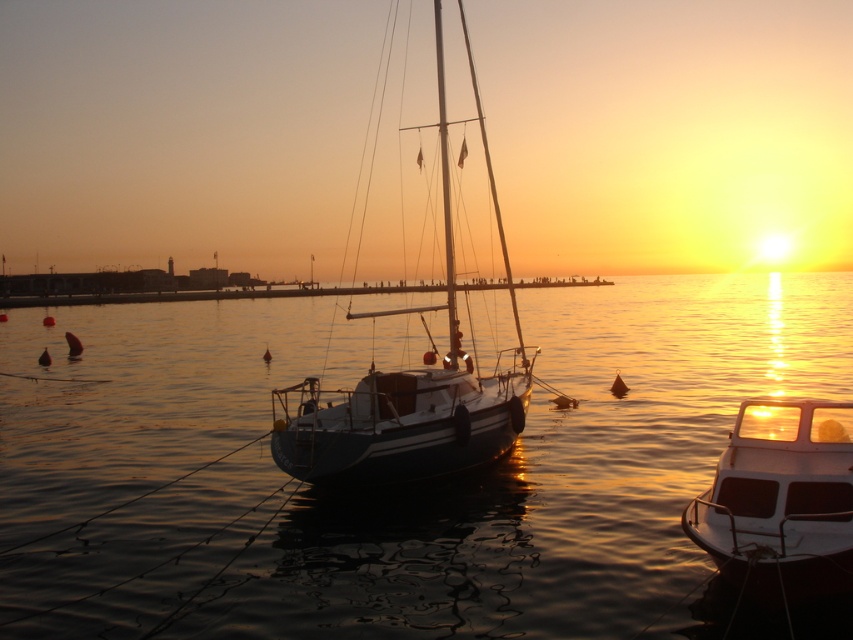
Who is taller, glossy water at center or white glossy sailboat at center?

white glossy sailboat at center

Between point (819, 273) and point (306, 420), which one is positioned behind?

The point (819, 273) is behind.

This screenshot has width=853, height=640. In order to click on glossy water at center in this screenshot , I will do `click(554, 476)`.

Can you confirm if white glossy sailboat at center is thinner than white glossy boat at lower right?

Incorrect, white glossy sailboat at center's width is not less than white glossy boat at lower right's.

From the picture: Can you confirm if white glossy sailboat at center is positioned to the left of white glossy boat at lower right?

Yes, white glossy sailboat at center is to the left of white glossy boat at lower right.

In order to click on white glossy sailboat at center in this screenshot , I will do `click(412, 380)`.

Is point (424, 545) positioned in front of point (846, 561)?

No, (424, 545) is further to viewer.

Can you confirm if glossy water at center is positioned to the left of white glossy boat at lower right?

Yes, glossy water at center is to the left of white glossy boat at lower right.

The width and height of the screenshot is (853, 640). Identify the location of glossy water at center. (554, 476).

Locate an element on the screen. This screenshot has width=853, height=640. glossy water at center is located at coordinates (554, 476).